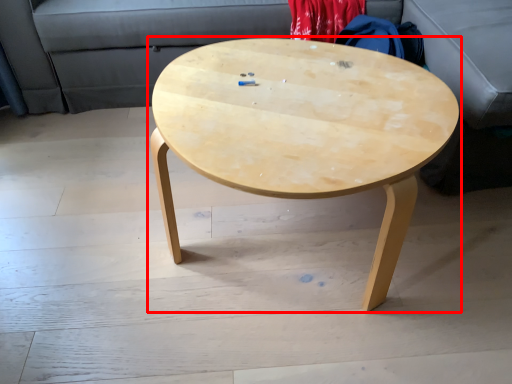
Question: In this image, where is coffee table (annotated by the red box) located relative to couch?

Choices:
 (A) left
 (B) right

Answer: (B)